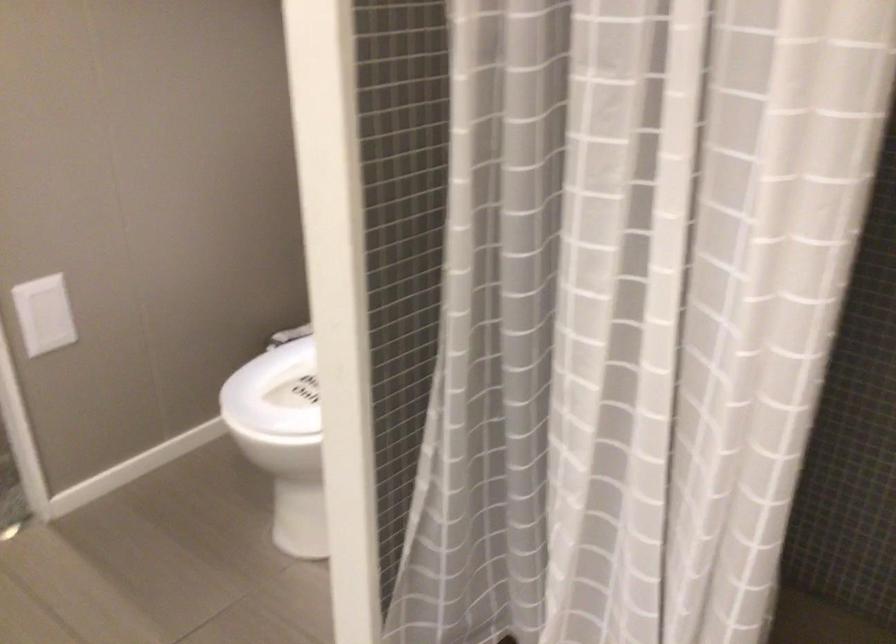
Identify the location of white light switch. (53, 323).